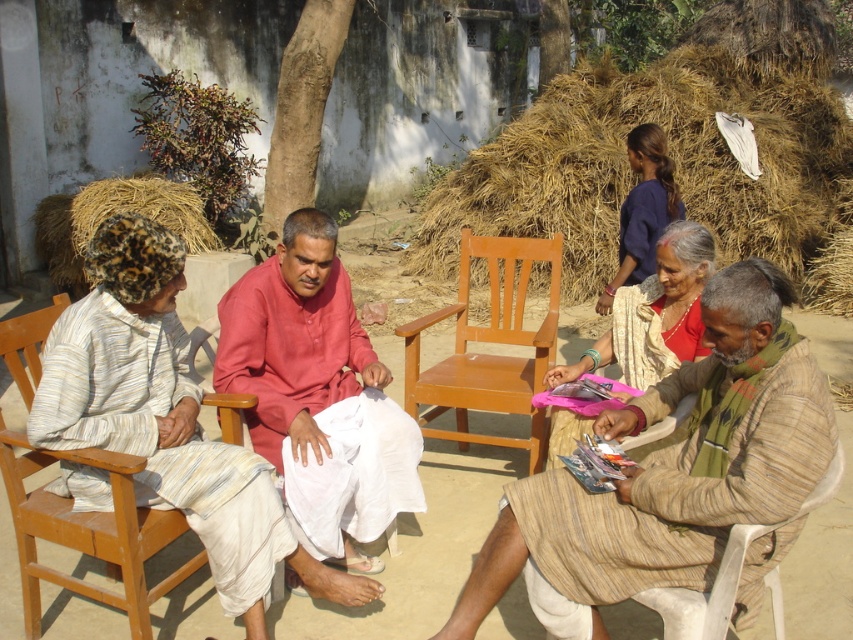
Question: Which object appears farthest from the camera in this image?

Choices:
 (A) matte pink kurta at center
 (B) brown straw at upper right

Answer: (B)

Question: Is brown straw at upper right wider than wooden chair at left?

Choices:
 (A) no
 (B) yes

Answer: (B)

Question: Which of the following is the closest to the observer?

Choices:
 (A) (196, 241)
 (B) (654, 196)
 (C) (18, 552)

Answer: (C)

Question: Is matte pink kurta at center to the right of wooden chair at left from the viewer's perspective?

Choices:
 (A) no
 (B) yes

Answer: (B)

Question: Can you confirm if striped cotton dhoti at center is positioned above matte pink kurta at center?

Choices:
 (A) yes
 (B) no

Answer: (B)

Question: Which point is closer to the camera taking this photo?

Choices:
 (A) (717, 608)
 (B) (115, 179)

Answer: (A)